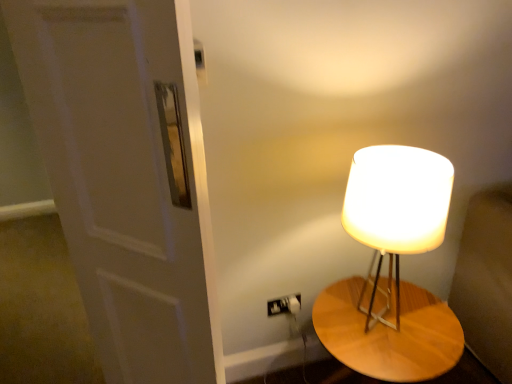
Image resolution: width=512 pixels, height=384 pixels. Find the location of `matte white lampshade at right`. matte white lampshade at right is located at coordinates (398, 198).

What is the approximate width of wooden table at right?

The width of wooden table at right is 54.60 centimeters.

What are the coordinates of `matte white lampshade at right` in the screenshot? It's located at (398, 198).

Between matte white lampshade at right and white matte door at left, which one appears on the left side from the viewer's perspective?

Positioned to the left is white matte door at left.

Is matte white lampshade at right wider than white matte door at left?

Indeed, matte white lampshade at right has a greater width compared to white matte door at left.

Is white matte door at left surrounded by matte white lampshade at right?

No, matte white lampshade at right does not contain white matte door at left.

Is matte white lampshade at right in contact with white matte door at left?

No, matte white lampshade at right is not making contact with white matte door at left.

Is white matte door at left aimed at wooden table at right?

No, white matte door at left is not oriented towards wooden table at right.

From a real-world perspective, is white matte door at left located beneath wooden table at right?

No.

Does white matte door at left touch wooden table at right?

There is a gap between white matte door at left and wooden table at right.

Is wooden table at right facing away from matte white lampshade at right?

That's not correct — wooden table at right is not looking away from matte white lampshade at right.

Does wooden table at right appear on the left side of matte white lampshade at right?

Incorrect, wooden table at right is not on the left side of matte white lampshade at right.

Where is `table on the right of matte white lampshade at right`? The width and height of the screenshot is (512, 384). table on the right of matte white lampshade at right is located at coordinates (389, 334).

Looking at this image, from a real-world perspective, who is located higher, wooden table at right or matte white lampshade at right?

matte white lampshade at right.

Is the position of wooden table at right less distant than that of white matte door at left?

No, wooden table at right is further to the viewer.

Does wooden table at right turn towards white matte door at left?

No, wooden table at right is not oriented towards white matte door at left.

Based on the photo, is wooden table at right positioned far away from white matte door at left?

No, there isn't a large distance between wooden table at right and white matte door at left.

Is matte white lampshade at right oriented away from wooden table at right?

That's not correct — matte white lampshade at right is not looking away from wooden table at right.

Considering the sizes of matte white lampshade at right and wooden table at right in the image, is matte white lampshade at right wider or thinner than wooden table at right?

matte white lampshade at right is thinner than wooden table at right.

Which of these two, matte white lampshade at right or wooden table at right, is bigger?

wooden table at right is bigger.

From the image's perspective, is matte white lampshade at right on top of wooden table at right?

Indeed, from the image's perspective, matte white lampshade at right is shown above wooden table at right.

Considering the relative positions of white matte door at left and matte white lampshade at right in the image provided, is white matte door at left to the left or to the right of matte white lampshade at right?

In the image, white matte door at left appears on the left side of matte white lampshade at right.

Is white matte door at left positioned behind matte white lampshade at right?

No.

Which object is thinner, white matte door at left or matte white lampshade at right?

Thinner between the two is white matte door at left.

Image resolution: width=512 pixels, height=384 pixels. I want to click on lamp above the white matte door at left (from the image's perspective), so click(398, 198).

Where is `door positioned vertically above the matte white lampshade at right (from a real-world perspective)`? The width and height of the screenshot is (512, 384). door positioned vertically above the matte white lampshade at right (from a real-world perspective) is located at coordinates (127, 176).

The image size is (512, 384). Identify the location of table that appears on the right of white matte door at left. (389, 334).

Considering their positions, is white matte door at left positioned closer to matte white lampshade at right than wooden table at right?

The object closer to matte white lampshade at right is wooden table at right.

When comparing their distances from matte white lampshade at right, does wooden table at right or white matte door at left seem further?

The object further to matte white lampshade at right is white matte door at left.

Estimate the real-world distances between objects in this image. Which object is further from wooden table at right, matte white lampshade at right or white matte door at left?

white matte door at left is further to wooden table at right.

From the image, which object appears to be nearer to wooden table at right, white matte door at left or matte white lampshade at right?

matte white lampshade at right is closer to wooden table at right.

From the image, which object appears to be farther from white matte door at left, wooden table at right or matte white lampshade at right?

Among the two, wooden table at right is located further to white matte door at left.

When comparing their distances from white matte door at left, does matte white lampshade at right or wooden table at right seem further?

The object further to white matte door at left is wooden table at right.

The image size is (512, 384). Identify the location of lamp situated between white matte door at left and wooden table at right from left to right. coord(398,198).